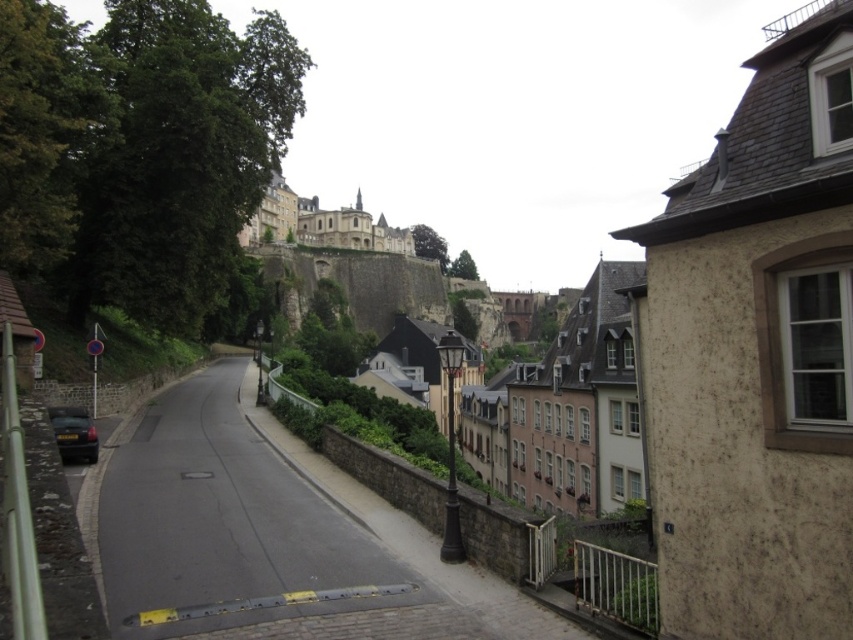
You are a tourist standing at the top of the slope looking down the road. You notice the brown rough stone wall at right and the metallic gray car at lower left. Which object takes up more space in the image?

The brown rough stone wall at right is larger in size than the metallic gray car at lower left, so it takes up more space in the image.

You are standing at the center of the road in the historic town scene. You want to walk towards the brown rough stone wall at right. In which direction should you move?

The brown rough stone wall at right is located at point 0.556 on the x axis and 0.889 on the y axis. Since you are at the center of the road, you should move towards the right and slightly forward to reach the wall.